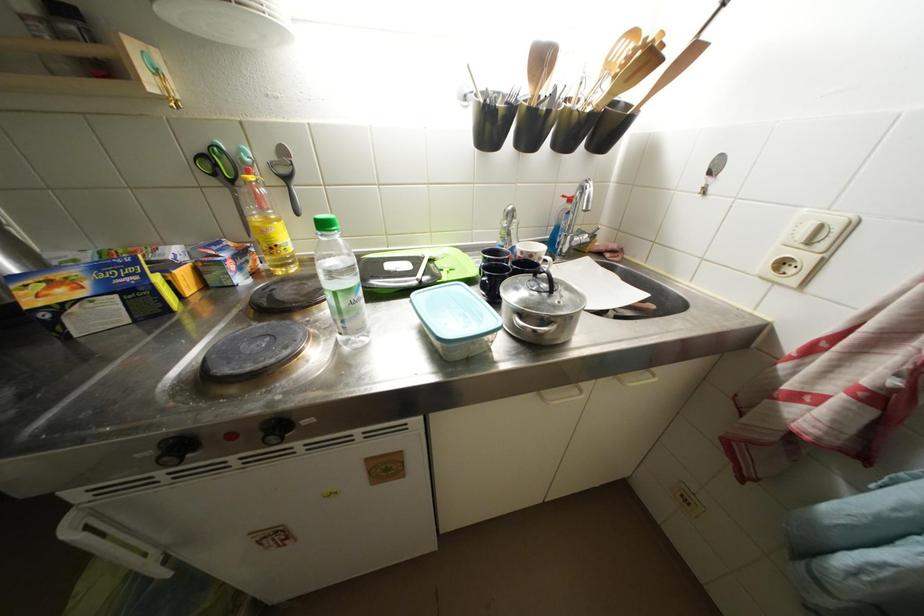
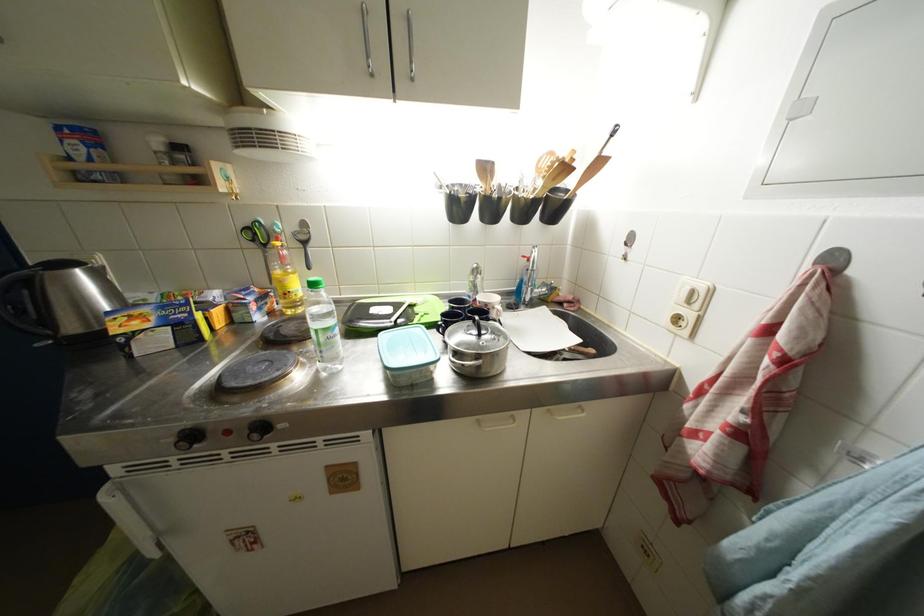
Locate, in the second image, the point that corresponds to pixel 650 47 in the first image.

(565, 164)